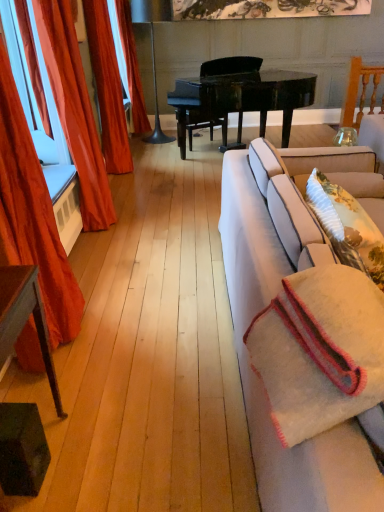
Question: Is white woven blanket at right at the right side of fluffy beige pillow at right?

Choices:
 (A) yes
 (B) no

Answer: (B)

Question: Does white woven blanket at right contain fluffy beige pillow at right?

Choices:
 (A) yes
 (B) no

Answer: (B)

Question: Is white woven blanket at right beside fluffy beige pillow at right?

Choices:
 (A) yes
 (B) no

Answer: (B)

Question: From the image's perspective, would you say white woven blanket at right is positioned over fluffy beige pillow at right?

Choices:
 (A) no
 (B) yes

Answer: (A)

Question: Is white woven blanket at right not within fluffy beige pillow at right?

Choices:
 (A) yes
 (B) no

Answer: (A)

Question: Considering the relative sizes of white woven blanket at right and fluffy beige pillow at right in the image provided, is white woven blanket at right wider than fluffy beige pillow at right?

Choices:
 (A) yes
 (B) no

Answer: (A)

Question: Could you tell me if shiny orange curtain at left, marked as the third curtain in a front-to-back arrangement, is facing green painted wood side table at lower left?

Choices:
 (A) no
 (B) yes

Answer: (A)

Question: Considering the relative sizes of shiny orange curtain at left, marked as the third curtain in a front-to-back arrangement, and green painted wood side table at lower left in the image provided, is shiny orange curtain at left, marked as the third curtain in a front-to-back arrangement, thinner than green painted wood side table at lower left?

Choices:
 (A) yes
 (B) no

Answer: (B)

Question: Does shiny orange curtain at left, marked as the third curtain in a front-to-back arrangement, appear on the left side of green painted wood side table at lower left?

Choices:
 (A) no
 (B) yes

Answer: (B)

Question: From a real-world perspective, is shiny orange curtain at left, marked as the third curtain in a front-to-back arrangement, located beneath green painted wood side table at lower left?

Choices:
 (A) yes
 (B) no

Answer: (B)

Question: Is shiny orange curtain at left, arranged as the 2th curtain when viewed from the back, oriented away from green painted wood side table at lower left?

Choices:
 (A) no
 (B) yes

Answer: (A)

Question: From the image's perspective, is shiny orange curtain at left, marked as the third curtain in a front-to-back arrangement, below green painted wood side table at lower left?

Choices:
 (A) yes
 (B) no

Answer: (B)

Question: From a real-world perspective, is white woven blanket at right positioned over white fabric couch at right based on gravity?

Choices:
 (A) no
 (B) yes

Answer: (B)